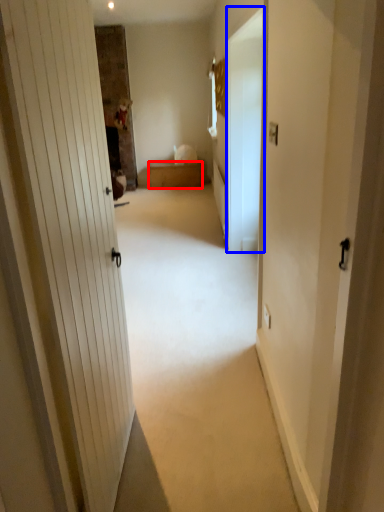
Question: Among these objects, which one is nearest to the camera, furniture (highlighted by a red box) or screen door (highlighted by a blue box)?

Choices:
 (A) furniture
 (B) screen door

Answer: (B)